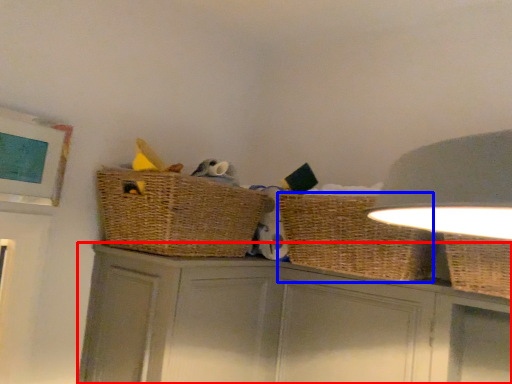
Question: Among these objects, which one is nearest to the camera, cabinetry (highlighted by a red box) or basket (highlighted by a blue box)?

Choices:
 (A) cabinetry
 (B) basket

Answer: (A)